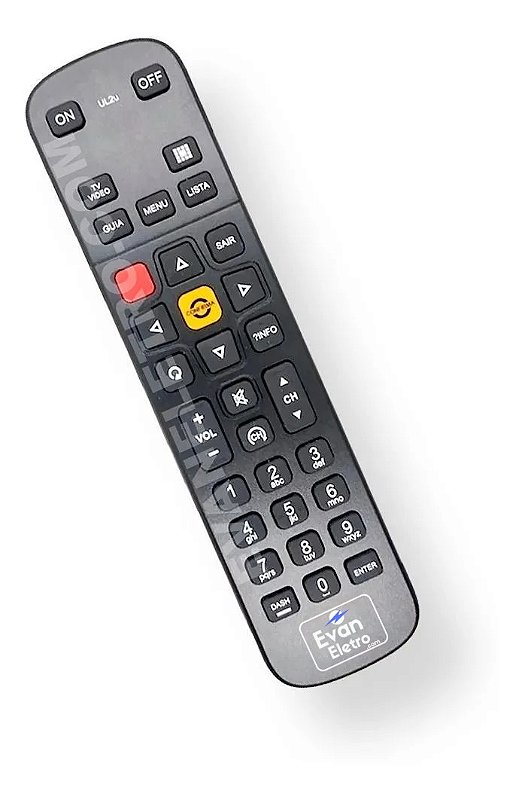
Identify the location of # button on remote. (226, 496), (279, 470), (310, 460), (327, 486), (287, 510), (258, 529), (271, 562), (304, 553), (322, 582), (345, 534).